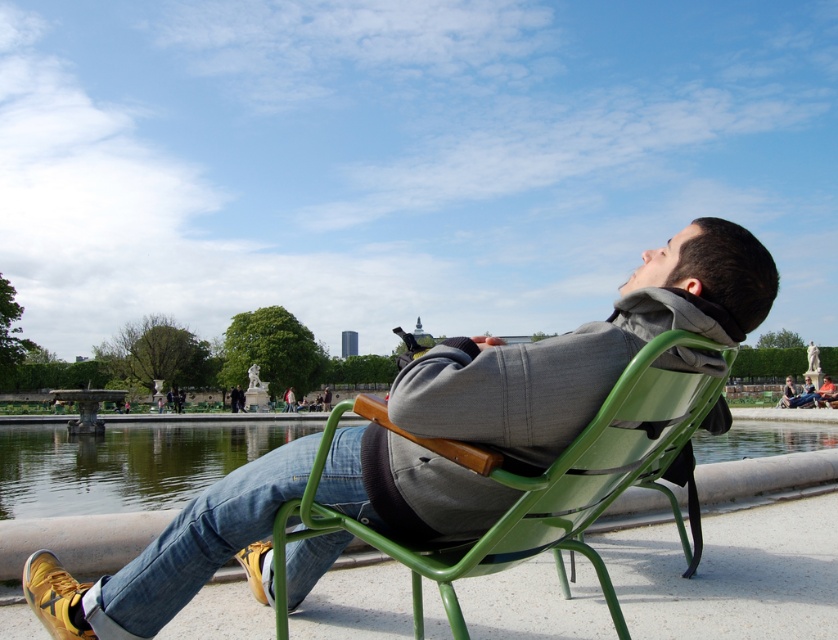
Does matte gray jacket at center have a larger size compared to green metal chair at center?

No.

At what (x,y) coordinates should I click in order to perform the action: click on matte gray jacket at center. Please return your answer as a coordinate pair (x, y). The height and width of the screenshot is (640, 838). Looking at the image, I should click on (583, 349).

Locate an element on the screen. matte gray jacket at center is located at coordinates (583, 349).

Is green metal chair at center smaller than clear water at chair right?

Correct, green metal chair at center occupies less space than clear water at chair right.

Between green metal chair at center and clear water at chair right, which one has more height?

Standing taller between the two is clear water at chair right.

The width and height of the screenshot is (838, 640). What do you see at coordinates (530, 481) in the screenshot? I see `green metal chair at center` at bounding box center [530, 481].

Find the location of a particular element. Image resolution: width=838 pixels, height=640 pixels. green metal chair at center is located at coordinates (530, 481).

Who is lower down, matte gray jacket at center or clear water at chair right?

clear water at chair right

Does matte gray jacket at center appear on the right side of clear water at chair right?

Correct, you'll find matte gray jacket at center to the right of clear water at chair right.

I want to click on matte gray jacket at center, so click(x=583, y=349).

In order to click on matte gray jacket at center in this screenshot , I will do `click(583, 349)`.